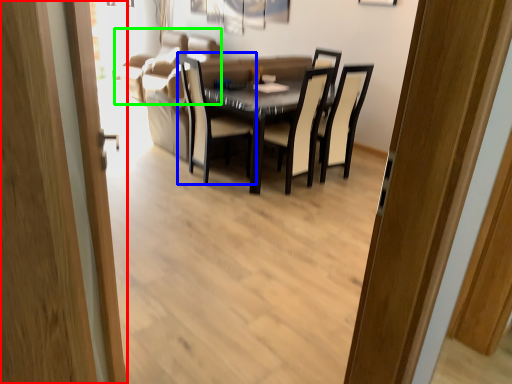
Question: Based on their relative distances, which object is nearer to door (highlighted by a red box)? Choose from chair (highlighted by a blue box) and couch (highlighted by a green box).

Choices:
 (A) chair
 (B) couch

Answer: (A)